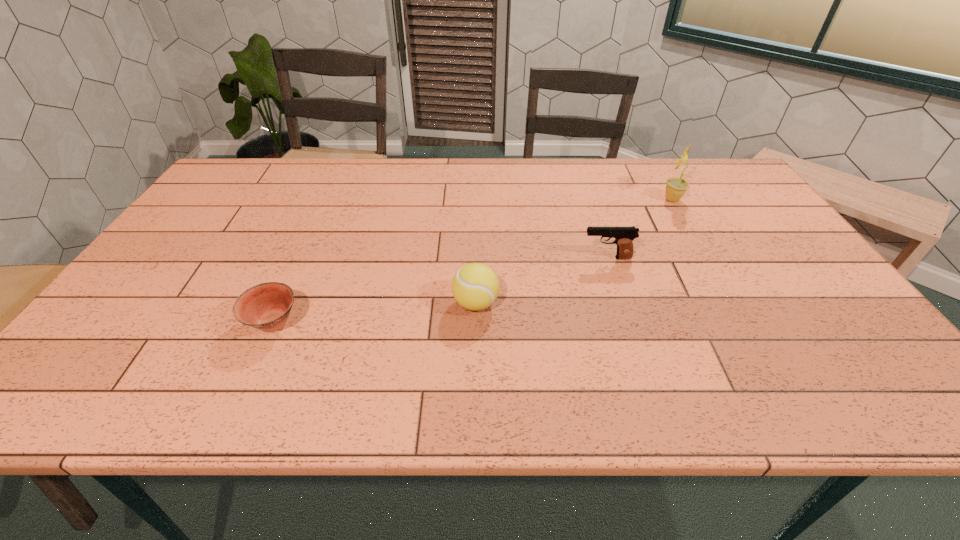
This screenshot has width=960, height=540. In order to click on vacant space located on the right of the third object from right to left in this screenshot , I will do `click(592, 303)`.

This screenshot has width=960, height=540. I want to click on vacant space located at the barrel of the pistol, so click(449, 258).

This screenshot has width=960, height=540. Identify the location of vacant region located at the barrel of the pistol. (445, 258).

In order to click on free space located at the barrel of the pistol in this screenshot , I will do `click(545, 258)`.

Identify the location of vacant point located 0.050m on the left of the leftmost object. pyautogui.click(x=225, y=322).

Image resolution: width=960 pixels, height=540 pixels. What are the coordinates of `object that is at the far edge` in the screenshot? It's located at pyautogui.click(x=676, y=187).

Locate an element on the screen. vacant space at the far edge of the desktop is located at coordinates (670, 178).

In the image, there is a desktop. Where is `vacant space at the left edge`? The width and height of the screenshot is (960, 540). vacant space at the left edge is located at coordinates (225, 210).

In the image, there is a desktop. Where is `vacant space at the right edge`? This screenshot has height=540, width=960. vacant space at the right edge is located at coordinates (722, 208).

You are a GUI agent. You are given a task and a screenshot of the screen. Output one action in this format:
    pyautogui.click(x=<x>, y=<y>)
    Task: Click on the vacant space at the far left corner of the desktop
    This screenshot has height=540, width=960.
    Given the screenshot: What is the action you would take?
    pyautogui.click(x=269, y=177)